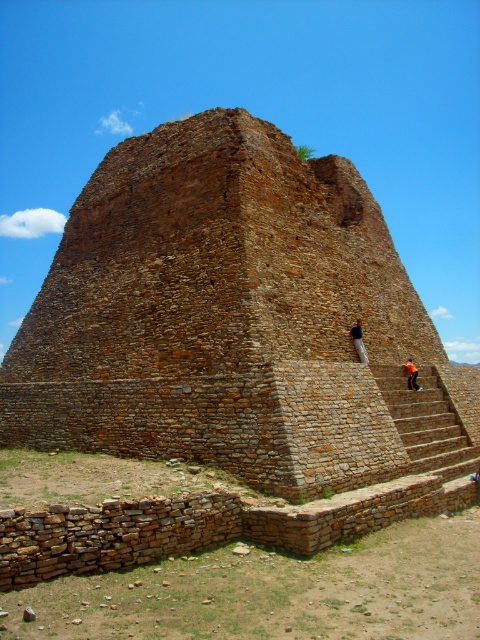
You are standing at the base of the brown stone ruins at center and looking towards the orange fabric person at upper right. Which object is higher in elevation?

The brown stone ruins at center is taller than the orange fabric person at upper right, so the brown stone ruins at center is higher in elevation.

You are an archaeologist examining the ancient stone structure. You notice two figures depicted on the structure. One is a dark brown stone person at upper center and the other is an orange fabric person at upper right. Based on their positions and sizes, which figure appears to be closer to the top of the structure?

The dark brown stone person at upper center is thinner than the orange fabric person at upper right, which suggests that the dark brown stone person at upper center is farther away and thus closer to the top of the structure.

You are standing at the base of the brown stone ruins at center and want to reach the dark brown stone person at upper center. Which direction should you move to get closer to them?

You should move upwards towards the top of the brown stone ruins at center since the dark brown stone person at upper center is located at the upper part of the structure, which is higher in elevation.